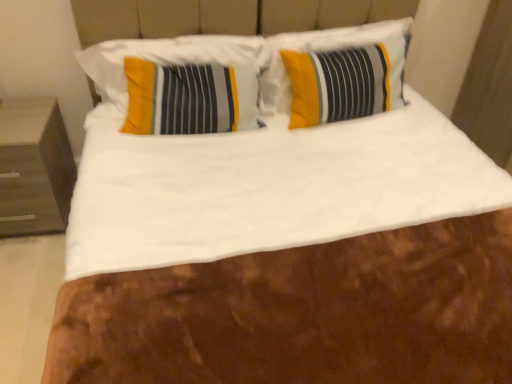
Question: From the image's perspective, is yellow striped pillow at upper left, the 2th pillow positioned from the right, over yellow fabric pillow at center, marked as the second pillow in a left-to-right arrangement?

Choices:
 (A) no
 (B) yes

Answer: (A)

Question: Considering the relative sizes of yellow striped pillow at upper left, the first pillow positioned from the left, and yellow fabric pillow at center, marked as the second pillow in a left-to-right arrangement, in the image provided, is yellow striped pillow at upper left, the first pillow positioned from the left, wider than yellow fabric pillow at center, marked as the second pillow in a left-to-right arrangement,?

Choices:
 (A) yes
 (B) no

Answer: (B)

Question: From a real-world perspective, is yellow striped pillow at upper left, the 2th pillow positioned from the right, over yellow fabric pillow at center, positioned as the 1th pillow in right-to-left order?

Choices:
 (A) no
 (B) yes

Answer: (B)

Question: Does yellow striped pillow at upper left, the 2th pillow positioned from the right, appear on the left side of yellow fabric pillow at center, positioned as the 1th pillow in right-to-left order?

Choices:
 (A) no
 (B) yes

Answer: (B)

Question: Is yellow striped pillow at upper left, the 2th pillow positioned from the right, taller than yellow fabric pillow at center, marked as the second pillow in a left-to-right arrangement?

Choices:
 (A) yes
 (B) no

Answer: (B)

Question: Is yellow striped pillow at upper left, the first pillow positioned from the left, turned away from yellow fabric pillow at center, marked as the second pillow in a left-to-right arrangement?

Choices:
 (A) yes
 (B) no

Answer: (B)

Question: Does yellow fabric pillow at center, positioned as the 1th pillow in right-to-left order, have a larger size compared to yellow striped pillow at upper left, the 2th pillow positioned from the right?

Choices:
 (A) yes
 (B) no

Answer: (A)

Question: Can you confirm if yellow fabric pillow at center, positioned as the 1th pillow in right-to-left order, is positioned to the right of yellow striped pillow at upper left, the first pillow positioned from the left?

Choices:
 (A) no
 (B) yes

Answer: (B)

Question: Is yellow fabric pillow at center, positioned as the 1th pillow in right-to-left order, wider than yellow striped pillow at upper left, the 2th pillow positioned from the right?

Choices:
 (A) no
 (B) yes

Answer: (B)

Question: Is yellow fabric pillow at center, positioned as the 1th pillow in right-to-left order, at the left side of yellow striped pillow at upper left, the first pillow positioned from the left?

Choices:
 (A) no
 (B) yes

Answer: (A)

Question: From a real-world perspective, is yellow fabric pillow at center, marked as the second pillow in a left-to-right arrangement, physically above yellow striped pillow at upper left, the 2th pillow positioned from the right?

Choices:
 (A) no
 (B) yes

Answer: (A)

Question: Does yellow fabric pillow at center, positioned as the 1th pillow in right-to-left order, have a greater height compared to yellow striped pillow at upper left, the 2th pillow positioned from the right?

Choices:
 (A) yes
 (B) no

Answer: (A)

Question: Is yellow fabric pillow at center, marked as the second pillow in a left-to-right arrangement, located within dark wood nightstand at left?

Choices:
 (A) yes
 (B) no

Answer: (B)